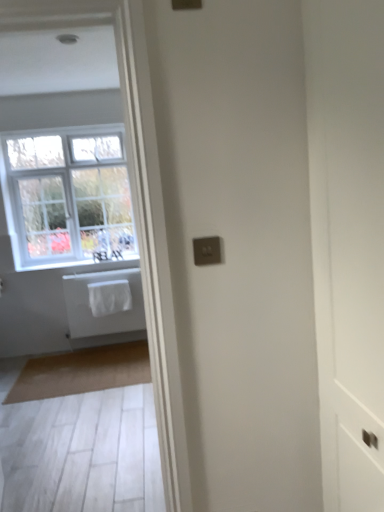
The height and width of the screenshot is (512, 384). What do you see at coordinates (85, 266) in the screenshot? I see `white fabric at lower left` at bounding box center [85, 266].

The width and height of the screenshot is (384, 512). What do you see at coordinates (207, 251) in the screenshot? I see `satin gold switchplate at center` at bounding box center [207, 251].

Describe the element at coordinates (109, 297) in the screenshot. I see `white fabric laundry at center` at that location.

I want to click on beige carpet at lower left, so (x=82, y=372).

Who is smaller, white fabric at lower left or white fabric laundry at center?

Smaller between the two is white fabric at lower left.

From a real-world perspective, which is physically below, white fabric at lower left or white fabric laundry at center?

white fabric laundry at center is physically lower.

Which object is thinner, white fabric at lower left or white fabric laundry at center?

With smaller width is white fabric laundry at center.

Is white fabric laundry at center inside white fabric at lower left?

No, white fabric laundry at center is not surrounded by white fabric at lower left.

Are white fabric at lower left and white matte towel at left making contact?

No, white fabric at lower left is not next to white matte towel at left.

Considering the relative sizes of white fabric at lower left and white matte towel at left in the image provided, is white fabric at lower left thinner than white matte towel at left?

In fact, white fabric at lower left might be wider than white matte towel at left.

How far apart are white fabric at lower left and white matte towel at left?

white fabric at lower left and white matte towel at left are 11.16 inches apart.

Is white fabric at lower left oriented away from white matte towel at left?

No, white fabric at lower left is not facing the opposite direction of white matte towel at left.

Which is correct: satin gold switchplate at center is inside white fabric laundry at center, or outside of it?

The correct answer is: outside.

From the image's perspective, between satin gold switchplate at center and white fabric laundry at center, who is located below?

white fabric laundry at center, from the image's perspective.

From a real-world perspective, is satin gold switchplate at center above or below white fabric laundry at center?

satin gold switchplate at center is situated higher than white fabric laundry at center in the real world.

Could you tell me if beige carpet at lower left is facing white matte towel at left?

No, beige carpet at lower left is not turned towards white matte towel at left.

From the image's perspective, does beige carpet at lower left appear lower than white matte towel at left?

Yes, from the image's perspective, beige carpet at lower left is beneath white matte towel at left.

Is beige carpet at lower left in contact with white matte towel at left?

They are not placed beside each other.

Could white matte towel at left be considered to be inside beige carpet at lower left?

Definitely not — white matte towel at left is not inside beige carpet at lower left.

In the scene shown: Would you consider white fabric at lower left to be distant from satin gold switchplate at center?

Yes, white fabric at lower left and satin gold switchplate at center are quite far apart.

Is white fabric at lower left facing away from satin gold switchplate at center?

white fabric at lower left does not have its back to satin gold switchplate at center.

Which of these two, white fabric at lower left or satin gold switchplate at center, is thinner?

With smaller width is satin gold switchplate at center.

Looking at this image, is white fabric at lower left positioned in front of satin gold switchplate at center?

No, white fabric at lower left is behind satin gold switchplate at center.

Is white fabric laundry at center at the back of white matte towel at left?

Yes, white fabric laundry at center is at the back of white matte towel at left.

Can you confirm if white matte towel at left is taller than white fabric laundry at center?

Yes.

In the scene shown: How different are the orientations of white matte towel at left and white fabric laundry at center in degrees?

The angular difference between white matte towel at left and white fabric laundry at center is 0.00414 degrees.

Is point (111, 317) closer to viewer compared to point (103, 285)?

No, (111, 317) is behind (103, 285).

Which object is closer to the camera, white painted wood window at upper left or satin gold switchplate at center?

satin gold switchplate at center is more forward.

Can you confirm if white painted wood window at upper left is positioned to the right of satin gold switchplate at center?

No, white painted wood window at upper left is not to the right of satin gold switchplate at center.

Is satin gold switchplate at center located within white painted wood window at upper left?

No, satin gold switchplate at center is not surrounded by white painted wood window at upper left.

You are a GUI agent. You are given a task and a screenshot of the screen. Output one action in this format:
    pyautogui.click(x=<x>, y=<y>)
    Task: Click on the laundry on the right of white fabric at lower left
    The height and width of the screenshot is (512, 384).
    Given the screenshot: What is the action you would take?
    pyautogui.click(x=109, y=297)

This screenshot has width=384, height=512. In the image, there is a white fabric at lower left. In order to click on bath below it (from a real-world perspective) in this screenshot , I will do `click(104, 303)`.

Which object lies nearer to the anchor point white fabric laundry at center, white painted wood window at upper left or white matte towel at left?

white matte towel at left lies closer to white fabric laundry at center than the other object.

Considering their positions, is beige carpet at lower left positioned further to white painted wood window at upper left than white matte towel at left?

beige carpet at lower left lies further to white painted wood window at upper left than the other object.

When comparing their distances from white fabric at lower left, does white fabric laundry at center or white painted wood window at upper left seem closer?

Among the two, white fabric laundry at center is located nearer to white fabric at lower left.

Looking at the image, which one is located further to beige carpet at lower left, white fabric laundry at center or satin gold switchplate at center?

satin gold switchplate at center.

Estimate the real-world distances between objects in this image. Which object is further from white fabric at lower left, satin gold switchplate at center or white matte towel at left?

satin gold switchplate at center.

Considering their positions, is beige carpet at lower left positioned further to satin gold switchplate at center than white painted wood window at upper left?

Based on the image, white painted wood window at upper left appears to be further to satin gold switchplate at center.

Looking at this image, from the image, which object appears to be nearer to satin gold switchplate at center, white fabric laundry at center or white matte towel at left?

The object closer to satin gold switchplate at center is white fabric laundry at center.

When comparing their distances from white fabric at lower left, does beige carpet at lower left or white matte towel at left seem closer?

white matte towel at left is closer to white fabric at lower left.

This screenshot has height=512, width=384. I want to click on laundry between white painted wood window at upper left and white matte towel at left from top to bottom, so click(x=109, y=297).

Identify the location of laundry between white painted wood window at upper left and beige carpet at lower left vertically. This screenshot has height=512, width=384. (109, 297).

Where is `bath between satin gold switchplate at center and white fabric at lower left along the z-axis`? bath between satin gold switchplate at center and white fabric at lower left along the z-axis is located at coordinates (104, 303).

Identify the location of window sill between white painted wood window at upper left and white matte towel at left in the up-down direction. The width and height of the screenshot is (384, 512). (85, 266).